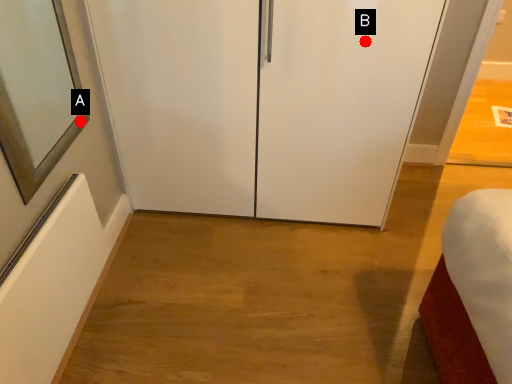
Question: Two points are circled on the image, labeled by A and B beside each circle. Which point is closer to the camera?

Choices:
 (A) A is closer
 (B) B is closer

Answer: (B)